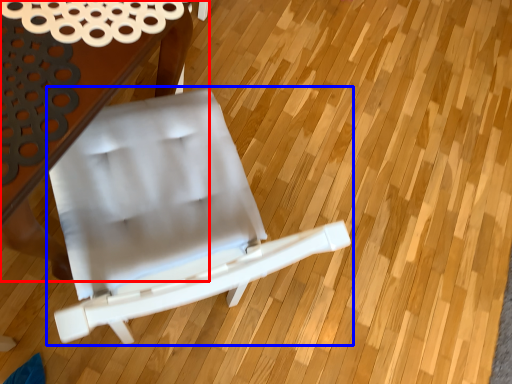
Question: Which object appears farthest to the camera in this image, table (highlighted by a red box) or chair (highlighted by a blue box)?

Choices:
 (A) table
 (B) chair

Answer: (A)